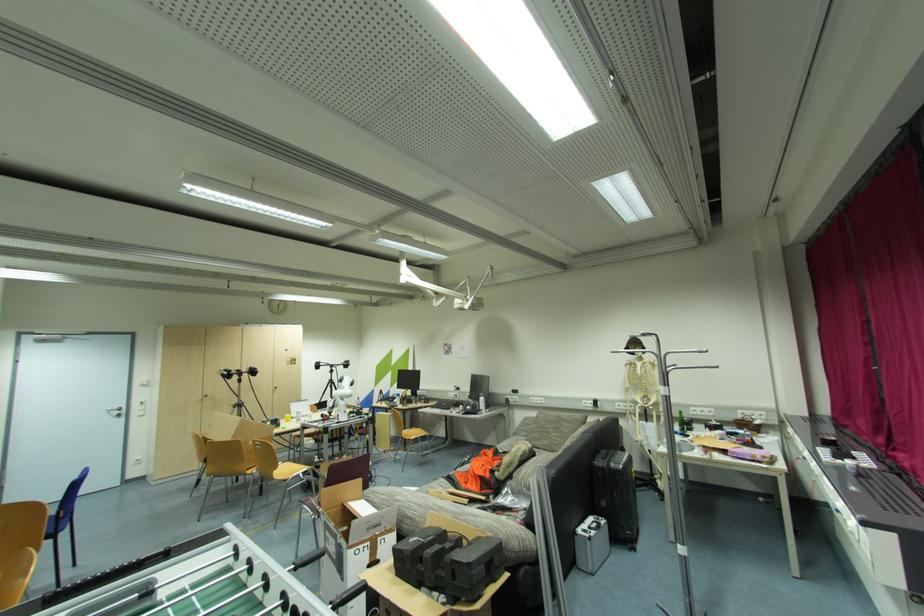
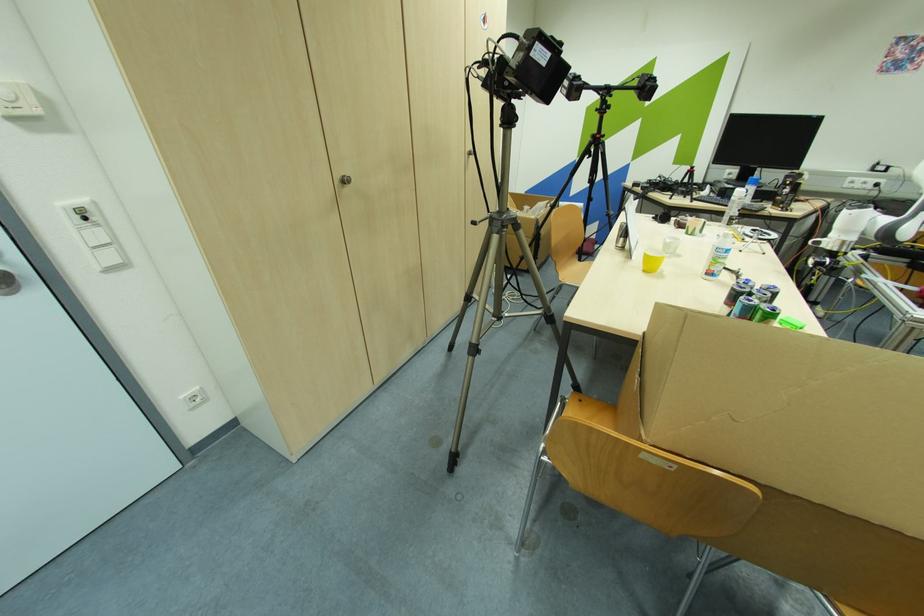
Locate, in the second image, the point that corresponds to point (141, 461) in the first image.

(198, 399)